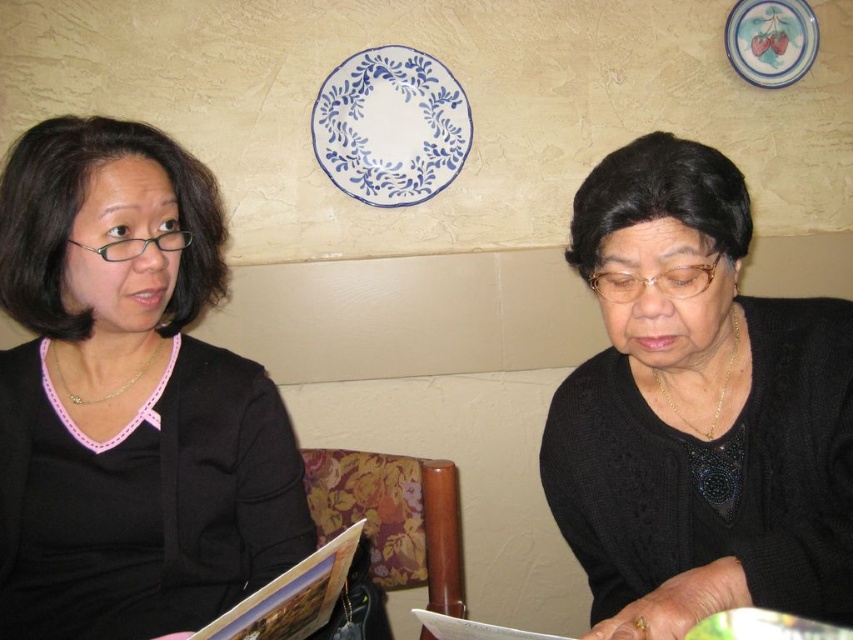
In the scene shown: Is black matte sweater at upper left bigger than black matte sweater at lower right?

Yes.

Which is in front, point (3, 198) or point (650, 609)?

Point (650, 609) is more forward.

This screenshot has height=640, width=853. Identify the location of black matte sweater at upper left. (128, 397).